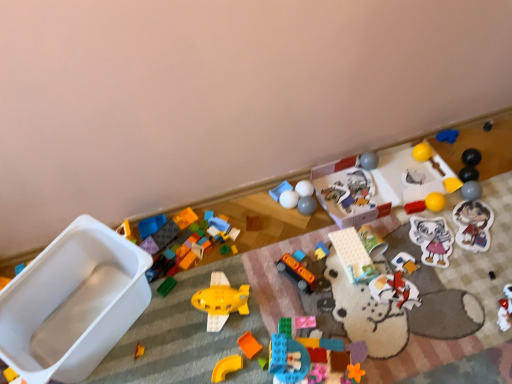
At what (x,y) coordinates should I click in order to perform the action: click on vacant area that lies between matte plastic stickers at lower right, which is counted as the third toy, starting from the right, and orange matte bus at center, the tenth toy when ordered from left to right. Please return your answer as a coordinate pair (x, y). Looking at the image, I should click on (405, 254).